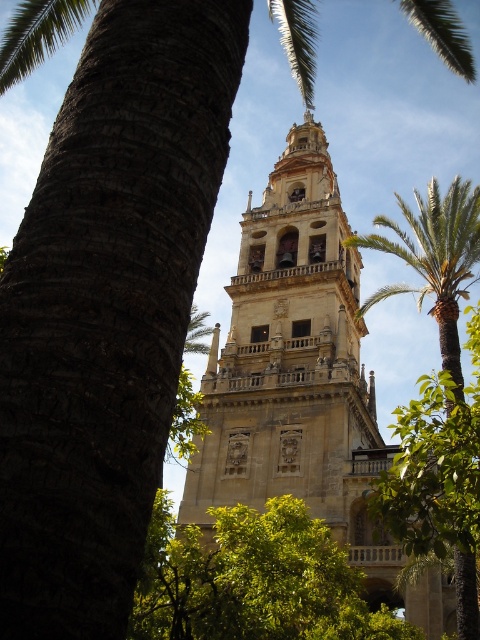
Who is shorter, beige stone tower at center or green leafy tree at center?

green leafy tree at center is shorter.

Who is more distant from viewer, (284, 220) or (298, 625)?

The point (284, 220) is behind.

Identify the location of beige stone tower at center. The width and height of the screenshot is (480, 640). (300, 378).

Is beige stone tower at center closer to camera compared to green leafy palm at center?

No, beige stone tower at center is further to the viewer.

In the scene shown: Is beige stone tower at center below green leafy palm at center?

Incorrect, beige stone tower at center is not positioned below green leafy palm at center.

Image resolution: width=480 pixels, height=640 pixels. I want to click on beige stone tower at center, so click(300, 378).

Is green leafy tree at center closer to camera compared to green leafy palm at center?

That is True.

Measure the distance from green leafy tree at center to green leafy palm at center.

A distance of 15.37 meters exists between green leafy tree at center and green leafy palm at center.

Which is in front, point (288, 627) or point (457, 620)?

Point (457, 620) is in front.

Where is `green leafy tree at center`? Image resolution: width=480 pixels, height=640 pixels. green leafy tree at center is located at coordinates (252, 580).